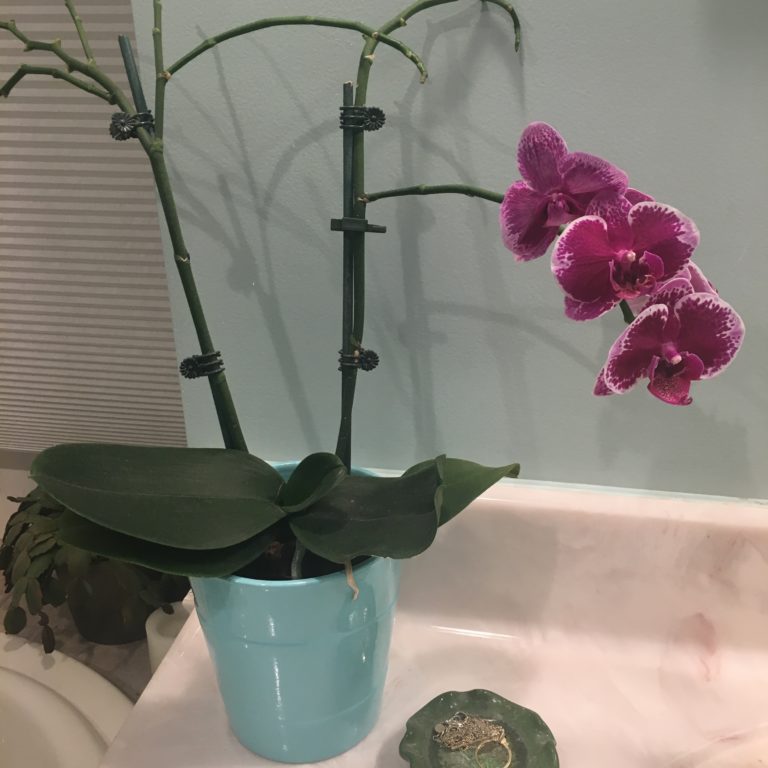
What are the coordinates of `orchid` in the screenshot? It's located at (641, 339).